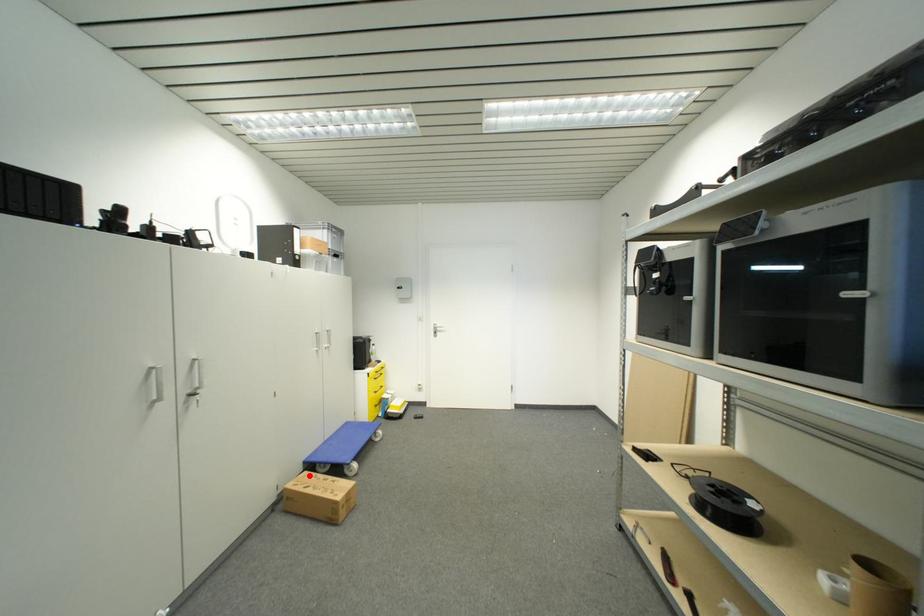
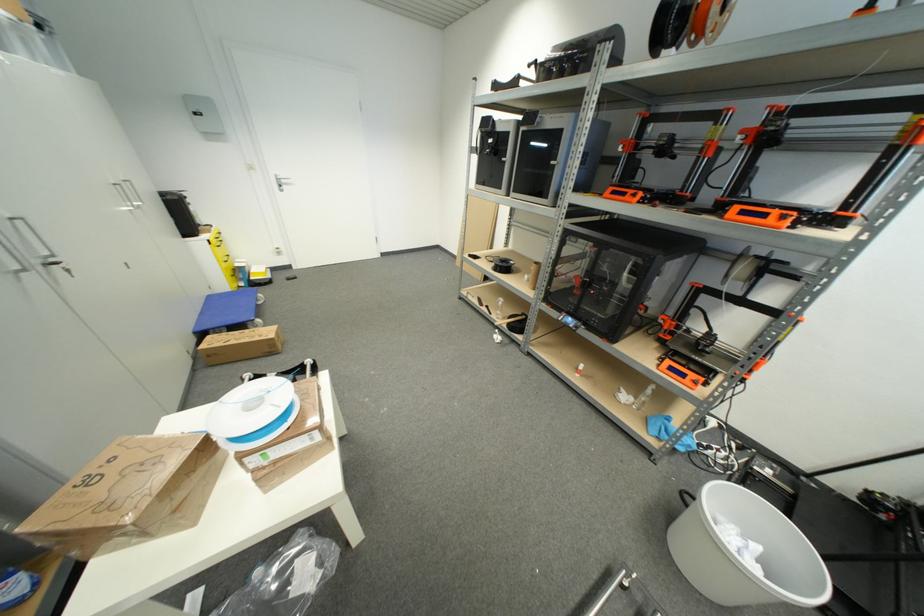
The point at the highlighted location is marked in the first image. Where is the corresponding point in the second image?

(213, 339)